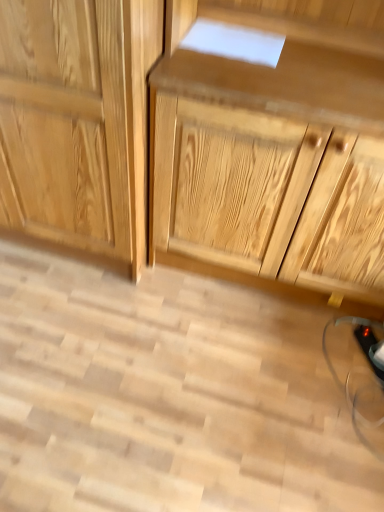
Question: From a real-world perspective, is natural wood drawer at center positioned above or below natural wood cabinet at center?

Choices:
 (A) below
 (B) above

Answer: (B)

Question: Which is correct: natural wood drawer at center is inside natural wood cabinet at center, or outside of it?

Choices:
 (A) inside
 (B) outside

Answer: (B)

Question: Is point (284, 144) closer or farther from the camera than point (109, 103)?

Choices:
 (A) closer
 (B) farther

Answer: (B)

Question: In the image, is natural wood cabinet at center positioned in front of or behind natural wood drawer at center?

Choices:
 (A) front
 (B) behind

Answer: (B)

Question: Is natural wood cabinet at center situated inside natural wood drawer at center or outside?

Choices:
 (A) inside
 (B) outside

Answer: (B)

Question: From their relative heights in the image, would you say natural wood cabinet at center is taller or shorter than natural wood drawer at center?

Choices:
 (A) tall
 (B) short

Answer: (B)

Question: From the image's perspective, is natural wood cabinet at center positioned above or below natural wood drawer at center?

Choices:
 (A) above
 (B) below

Answer: (A)